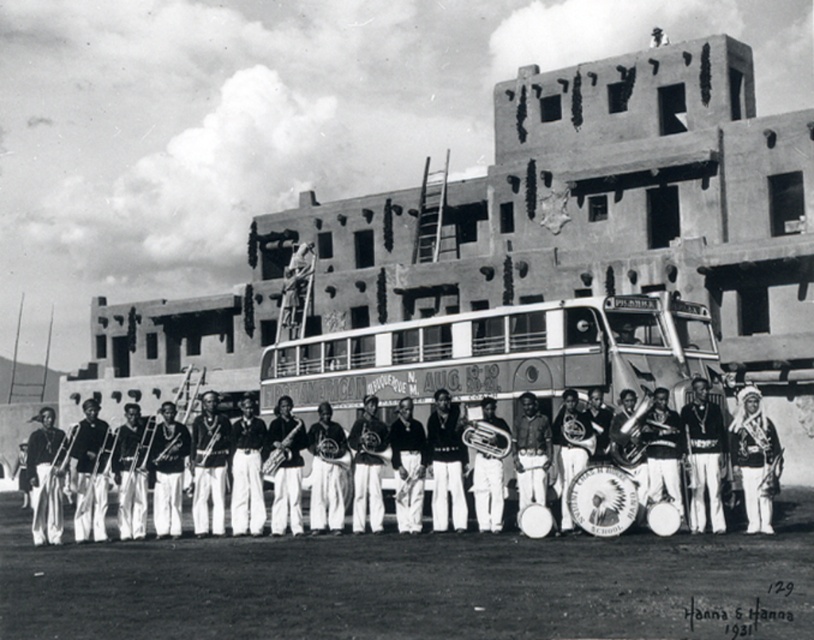
You are a photographer trying to capture the musicians in front of the building. You notice the metallic silver bus at center and the white fabric headdress at center. Which object should you adjust your camera angle to avoid blocking the view of the musicians?

You should adjust your camera angle to avoid the white fabric headdress at center because it is behind the metallic silver bus at center and might block the view of the musicians.

You are standing at the scene and want to hand a gift to the person wearing the white fabric headdress at center. Considering your height is 5.5 feet, can you reach them without any assistance?

The white fabric headdress at center is 201.12 feet away from viewer. Since the distance is too far, you cannot reach them without assistance.

You are a photographer trying to capture the entire scene of the musicians and the building in one shot. Given that the metallic silver bus at center is blocking part of the dark brown leather jacket at left, can you adjust your position to include both without moving the objects?

The metallic silver bus at center is smaller than the dark brown leather jacket at left, so you can move your camera position to the side of the bus to include both objects in the frame.